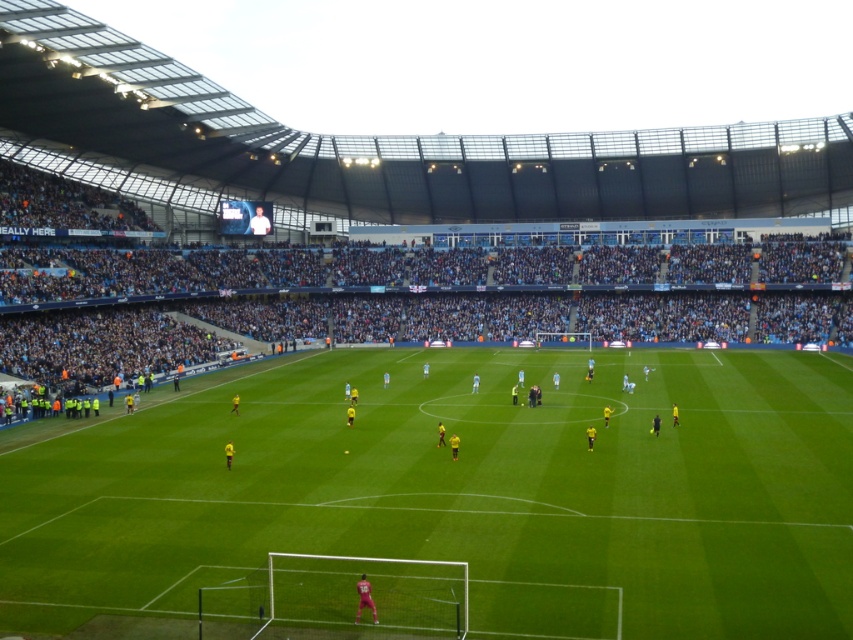
You are a drone operator assigned to capture aerial footage of the soccer match. The stadium has a restricted airspace zone at point coordinates between 0.7 and 0.8 on the x and y axes. Based on the green grass football field at center, will your drone be allowed to fly over it?

The green grass football field at center is located at point coordinates (461, 493), which falls within the restricted airspace zone between 0.7 and 0.8 on both axes. Therefore, the drone will not be allowed to fly over it.

You are a soccer fan watching the match from the stands. You notice the green grass football field at center and the light blue jersey at center. Which object is closer to you, the observer?

The green grass football field at center is closer to you because it is in front of the light blue jersey at center.

You are a photographer standing at the edge of the field. You want to take a photo that includes both the green grass football field at center and the light blue jersey at center. Which object should you focus on first to ensure it appears sharp in the photo?

The green grass football field at center is shorter than the light blue jersey at center, so you should focus on the light blue jersey at center first since it is closer to the camera.